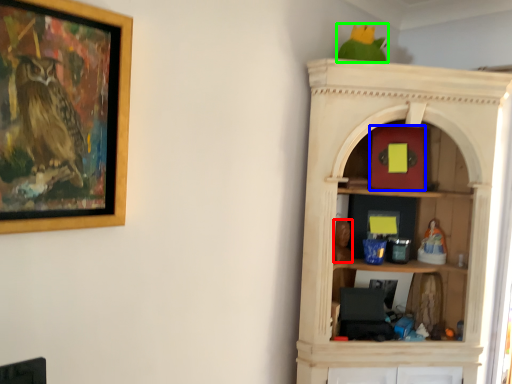
Question: Which object is positioned closest to toy (highlighted by a red box)? Select from toy (highlighted by a blue box) and parrot (highlighted by a green box).

Choices:
 (A) toy
 (B) parrot

Answer: (A)